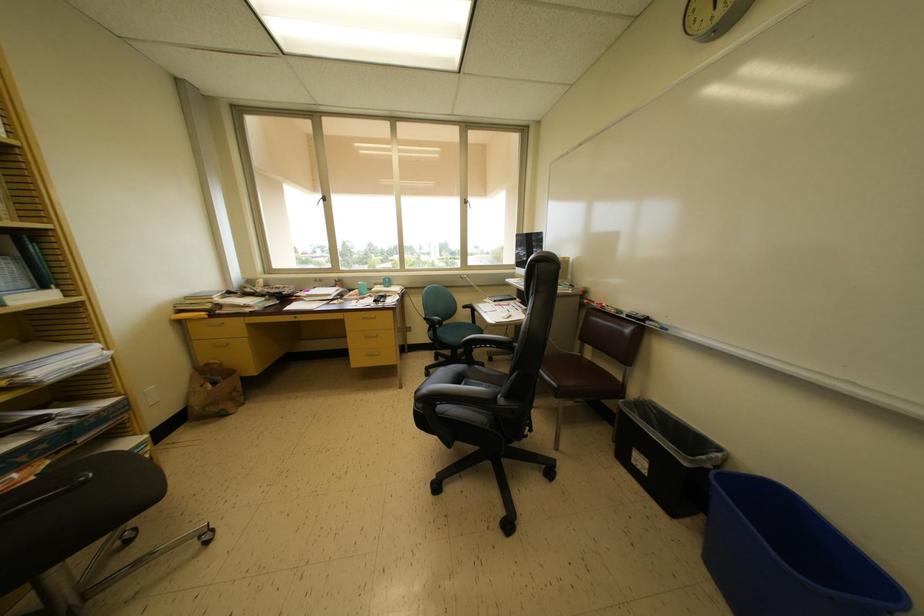
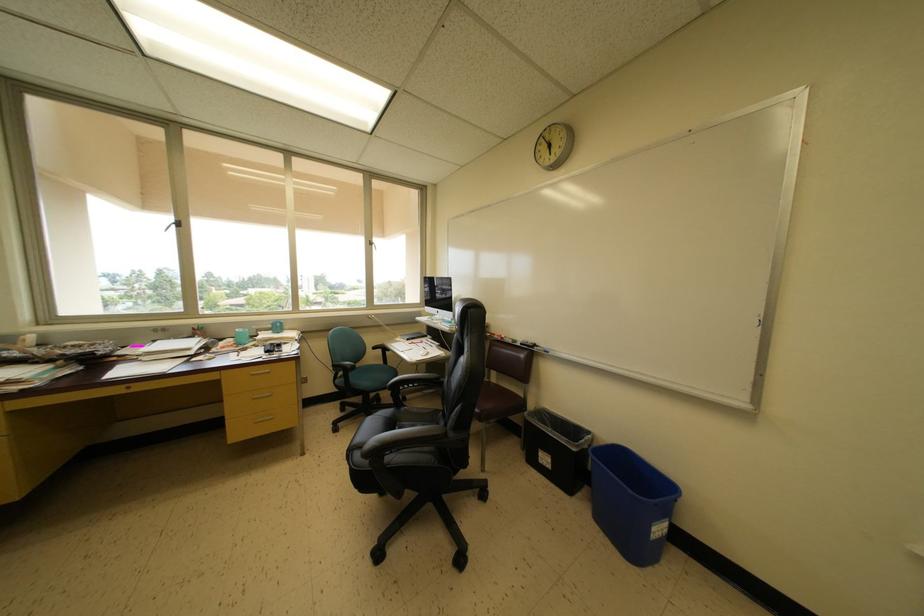
The point at (430, 323) is marked in the first image. Where is the corresponding point in the second image?

(338, 371)